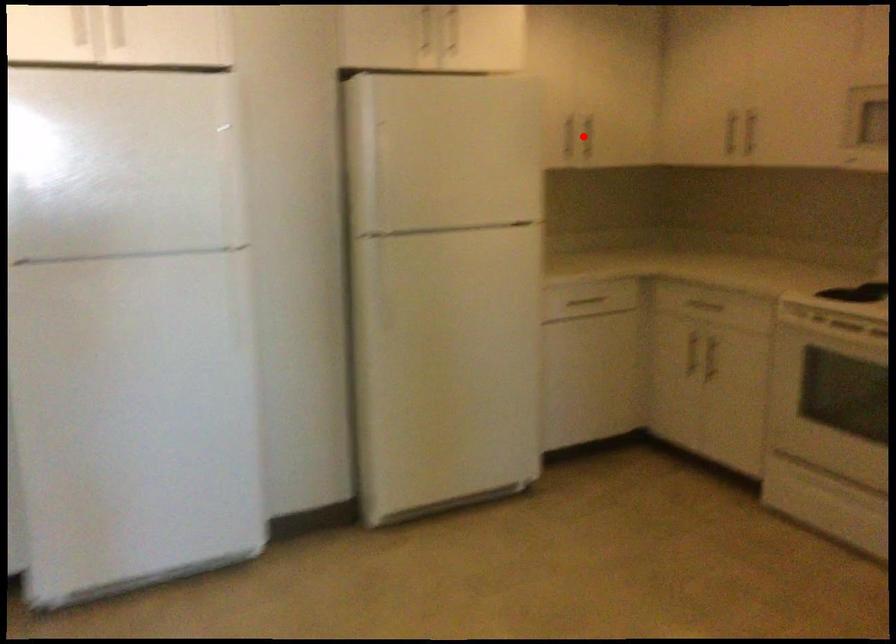
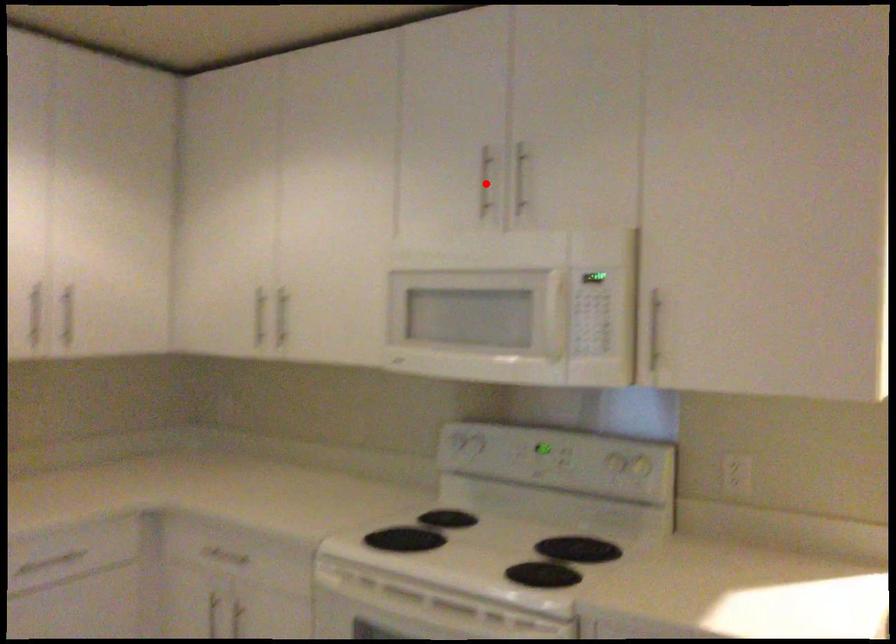
I am providing you with two images of the same scene from different viewpoints. A red point is marked on the first image and another point is marked on the second image. Does the point marked in image1 correspond to the same location as the one in image2?

No